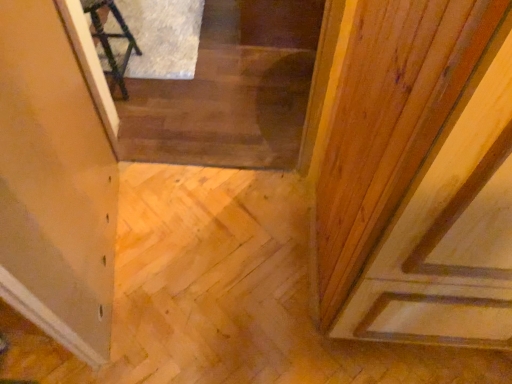
Identify the location of vacant space to the right of transparent glass door at upper left. Image resolution: width=512 pixels, height=384 pixels. (217, 263).